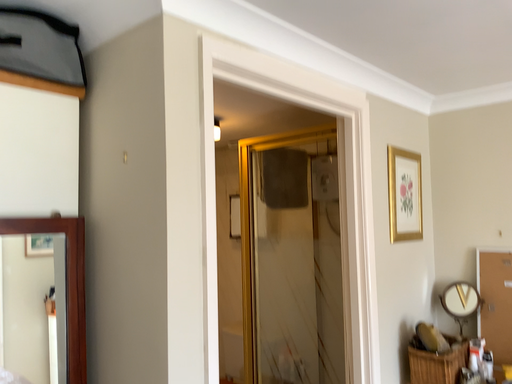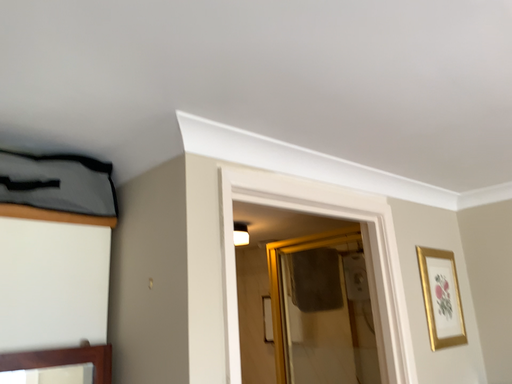
Question: Which way did the camera rotate in the video?

Choices:
 (A) rotated upward
 (B) rotated downward

Answer: (A)